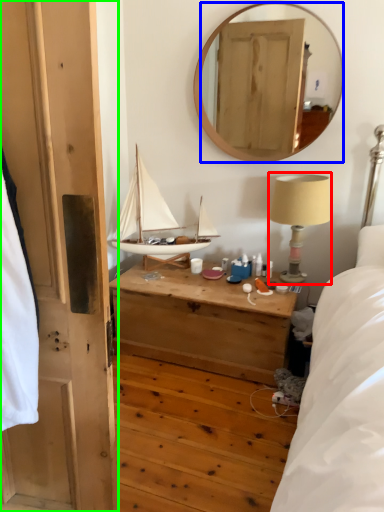
Question: Which object is positioned closest to table lamp (highlighted by a red box)? Select from mirror (highlighted by a blue box) and door (highlighted by a green box).

Choices:
 (A) mirror
 (B) door

Answer: (B)